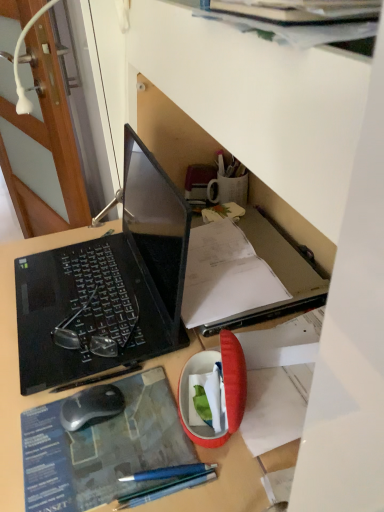
Question: Should I look upward or downward to see black matte laptop at left?

Choices:
 (A) down
 (B) up

Answer: (B)

Question: Does black matte laptop at left have a smaller size compared to wooden door at left?

Choices:
 (A) no
 (B) yes

Answer: (B)

Question: From a real-world perspective, is black matte laptop at left physically below wooden door at left?

Choices:
 (A) no
 (B) yes

Answer: (A)

Question: Can you see black matte laptop at left touching wooden door at left?

Choices:
 (A) yes
 (B) no

Answer: (B)

Question: Is black matte laptop at left behind wooden door at left?

Choices:
 (A) yes
 (B) no

Answer: (B)

Question: Considering the relative positions of black matte laptop at left and wooden door at left in the image provided, is black matte laptop at left to the left of wooden door at left from the viewer's perspective?

Choices:
 (A) yes
 (B) no

Answer: (B)

Question: From a real-world perspective, is black matte laptop at left on top of wooden door at left?

Choices:
 (A) no
 (B) yes

Answer: (B)

Question: Is silver matte computer mouse at lower left shorter than black matte laptop at left?

Choices:
 (A) no
 (B) yes

Answer: (B)

Question: From the image's perspective, would you say silver matte computer mouse at lower left is shown under black matte laptop at left?

Choices:
 (A) no
 (B) yes

Answer: (B)

Question: Does silver matte computer mouse at lower left have a larger size compared to black matte laptop at left?

Choices:
 (A) yes
 (B) no

Answer: (B)

Question: Is black matte laptop at left at the back of silver matte computer mouse at lower left?

Choices:
 (A) yes
 (B) no

Answer: (B)

Question: Can you confirm if silver matte computer mouse at lower left is thinner than black matte laptop at left?

Choices:
 (A) yes
 (B) no

Answer: (A)

Question: From a real-world perspective, does silver matte computer mouse at lower left sit lower than black matte laptop at left?

Choices:
 (A) no
 (B) yes

Answer: (B)

Question: From a real-world perspective, is wooden door at left located beneath blue paper at center?

Choices:
 (A) no
 (B) yes

Answer: (B)